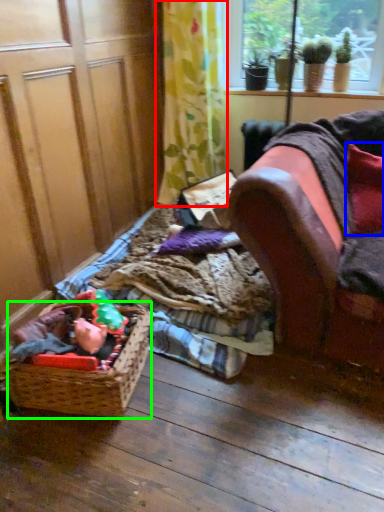
Question: Based on their relative distances, which object is farther from curtain (highlighted by a red box)? Choose from pillow (highlighted by a blue box) and basket (highlighted by a green box).

Choices:
 (A) pillow
 (B) basket

Answer: (B)